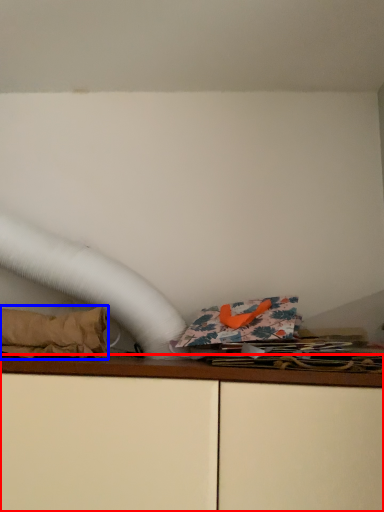
Question: Which object appears farthest to the camera in this image, furniture (highlighted by a red box) or material (highlighted by a blue box)?

Choices:
 (A) furniture
 (B) material

Answer: (B)